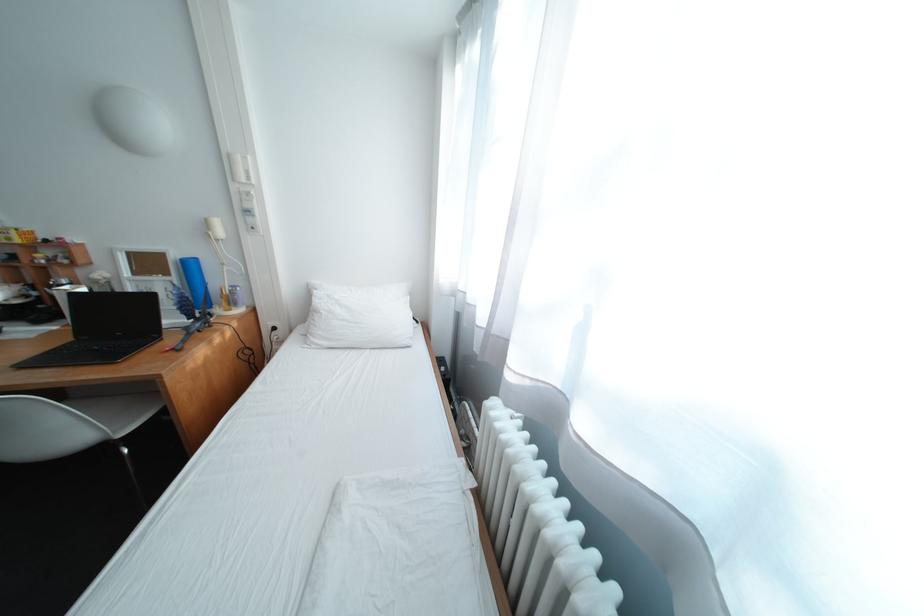
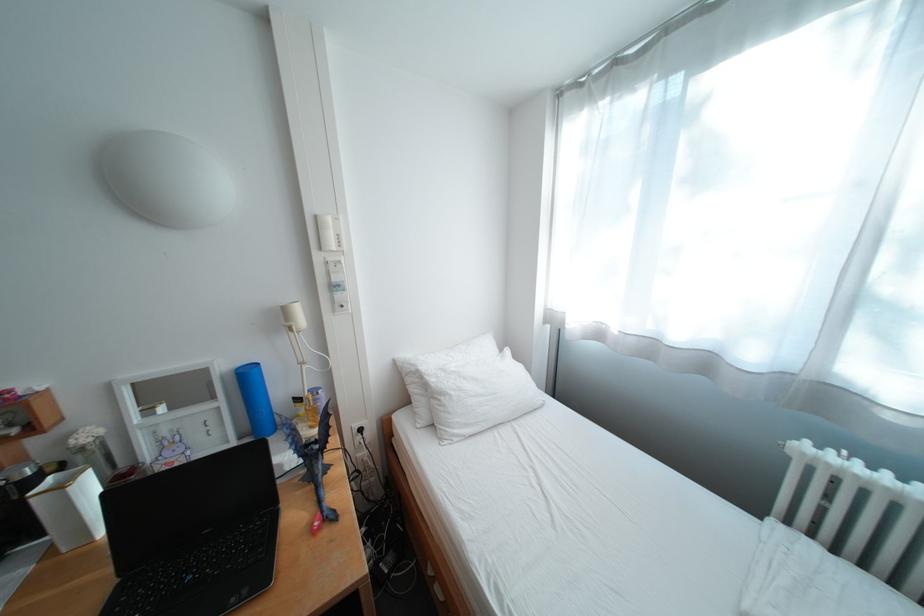
Question: In a continuous first-person perspective shot, in which direction is the camera moving?

Choices:
 (A) Left
 (B) Right
 (C) Forward
 (D) Backward

Answer: (A)